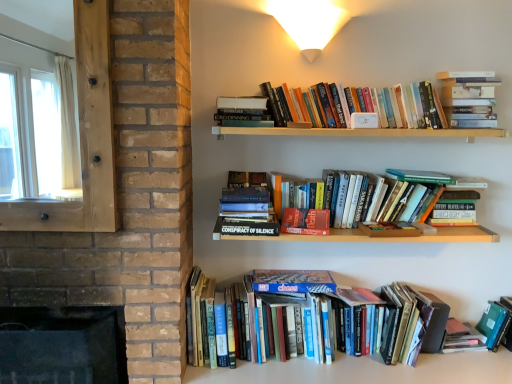
Question: Considering the relative positions of white matte wall sconce at upper center and hardcover books at upper right, the 5th book positioned from the bottom, in the image provided, is white matte wall sconce at upper center behind hardcover books at upper right, the 5th book positioned from the bottom,?

Choices:
 (A) yes
 (B) no

Answer: (B)

Question: Is white matte wall sconce at upper center taller than hardcover books at upper right, the 5th book positioned from the bottom?

Choices:
 (A) yes
 (B) no

Answer: (B)

Question: Can you confirm if white matte wall sconce at upper center is positioned to the left of hardcover books at upper right, the 5th book positioned from the bottom?

Choices:
 (A) no
 (B) yes

Answer: (B)

Question: Can you confirm if white matte wall sconce at upper center is thinner than hardcover books at upper right, the first book from the top?

Choices:
 (A) yes
 (B) no

Answer: (B)

Question: Can hardcover books at upper right, the 5th book positioned from the bottom, be found inside white matte wall sconce at upper center?

Choices:
 (A) no
 (B) yes

Answer: (A)

Question: Looking at the image, does hardcover book at center, which is the 2th paperback book in bottom-to-top order, seem bigger or smaller compared to white matte wall sconce at upper center?

Choices:
 (A) big
 (B) small

Answer: (B)

Question: Is hardcover book at center, arranged as the 1th paperback book when viewed from the left, spatially inside white matte wall sconce at upper center, or outside of it?

Choices:
 (A) inside
 (B) outside

Answer: (B)

Question: Is point (310, 216) closer or farther from the camera than point (307, 14)?

Choices:
 (A) farther
 (B) closer

Answer: (A)

Question: Considering their positions, is hardcover book at center, which is the 2th paperback book in bottom-to-top order, located in front of or behind white matte wall sconce at upper center?

Choices:
 (A) front
 (B) behind

Answer: (B)

Question: Is green matte folder at lower right, which is the fifth book from top to bottom, inside the boundaries of hardcover book at center, which is counted as the third book, starting from the bottom, or outside?

Choices:
 (A) inside
 (B) outside

Answer: (B)

Question: From a real-world perspective, is green matte folder at lower right, which is the fifth book from top to bottom, above or below hardcover book at center, which is counted as the third book, starting from the top?

Choices:
 (A) above
 (B) below

Answer: (B)

Question: In the image, is green matte folder at lower right, the 1th book when ordered from bottom to top, positioned in front of or behind hardcover book at center, which is counted as the third book, starting from the bottom?

Choices:
 (A) behind
 (B) front

Answer: (A)

Question: Visually, is green matte folder at lower right, the 1th book when ordered from bottom to top, positioned to the left or to the right of hardcover book at center, which is counted as the third book, starting from the top?

Choices:
 (A) left
 (B) right

Answer: (B)

Question: Is hardcover book at center right, marked as the 1th paperback book in a top-to-bottom arrangement, taller or shorter than hardcover books at lower center, the fourth book in the top-to-bottom sequence?

Choices:
 (A) tall
 (B) short

Answer: (B)

Question: Would you say hardcover book at center right, the second paperback book when ordered from right to left, is inside or outside hardcover books at lower center, the fourth book in the top-to-bottom sequence?

Choices:
 (A) outside
 (B) inside

Answer: (A)